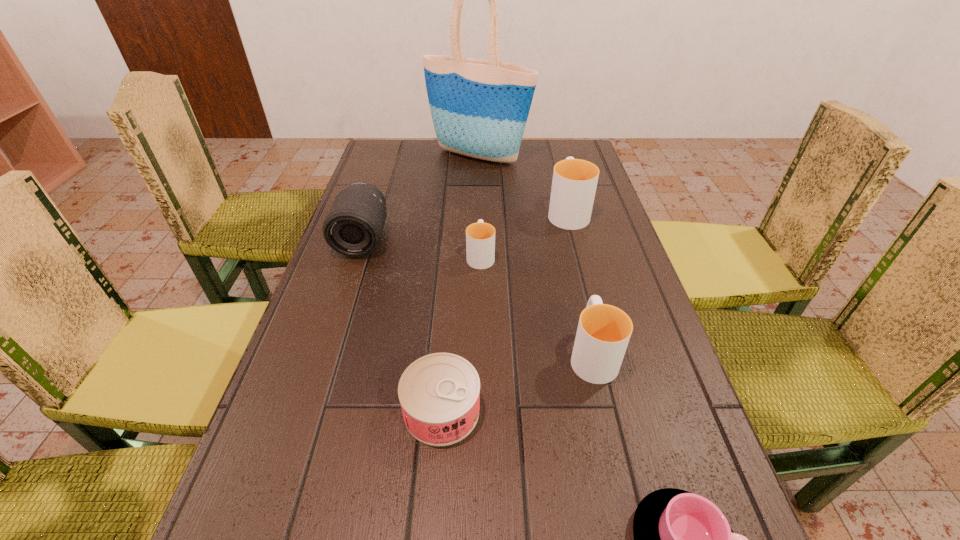
The width and height of the screenshot is (960, 540). In order to click on empty location between the can and the leftmost cup in this screenshot , I will do `click(461, 333)`.

Locate which object is the sixth closest to the can. Please provide its 2D coordinates. Your answer should be formatted as a tuple, i.e. [(x, y)], where the tuple contains the x and y coordinates of a point satisfying the conditions above.

[(479, 108)]

I want to click on the fourth closest object to the blue tote bag, so tap(603, 333).

Find the location of `cup that stands as the second closest to the pink cup`. cup that stands as the second closest to the pink cup is located at coordinates (480, 237).

In order to click on cup that stands as the second closest to the nearest cup in this screenshot , I will do `click(480, 237)`.

The height and width of the screenshot is (540, 960). In order to click on the third closest yellow cup relative to the can in this screenshot , I will do [x=574, y=183].

Where is `the closest yellow cup to the fourth tallest object`? This screenshot has width=960, height=540. the closest yellow cup to the fourth tallest object is located at coordinates (480, 237).

Where is `vacant space that satisfies the following two spatial constraints: 1. on the surface of the gray telephoto lens; 2. on the left side of the can`? Image resolution: width=960 pixels, height=540 pixels. vacant space that satisfies the following two spatial constraints: 1. on the surface of the gray telephoto lens; 2. on the left side of the can is located at coordinates (306, 410).